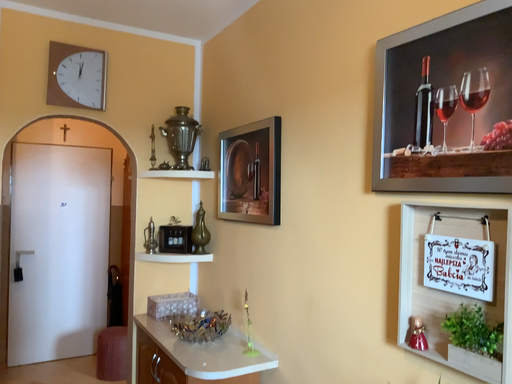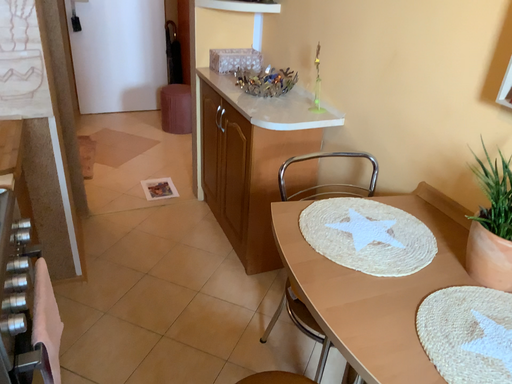
Question: How did the camera likely rotate when shooting the video?

Choices:
 (A) rotated downward
 (B) rotated upward

Answer: (A)